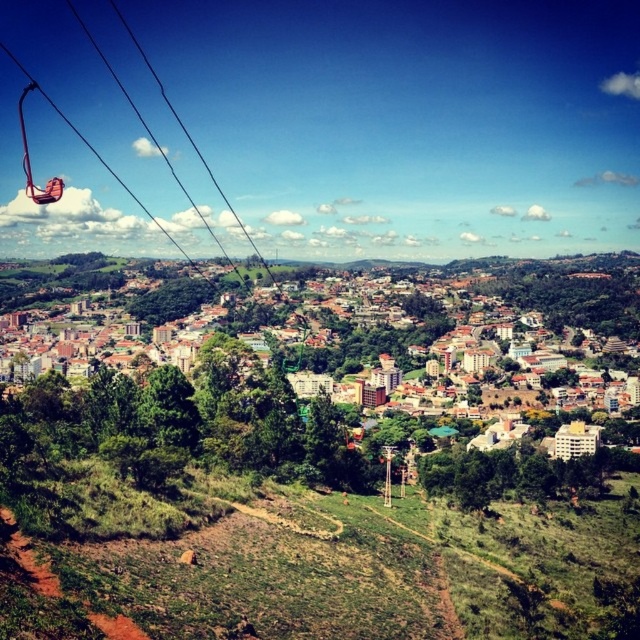
Question: Can you confirm if green leafy trees at center is thinner than metallic orange ski lift at left?

Choices:
 (A) no
 (B) yes

Answer: (A)

Question: Which object is farther from the camera taking this photo?

Choices:
 (A) metallic orange ski lift at left
 (B) green leafy trees at center

Answer: (A)

Question: From the image, what is the correct spatial relationship of green leafy trees at center in relation to metallic orange ski lift at left?

Choices:
 (A) right
 (B) left

Answer: (A)

Question: Does green leafy trees at center have a smaller size compared to metallic orange ski lift at left?

Choices:
 (A) no
 (B) yes

Answer: (A)

Question: Which of the following is the farthest from the observer?

Choices:
 (A) green leafy trees at center
 (B) metallic orange ski lift at left

Answer: (B)